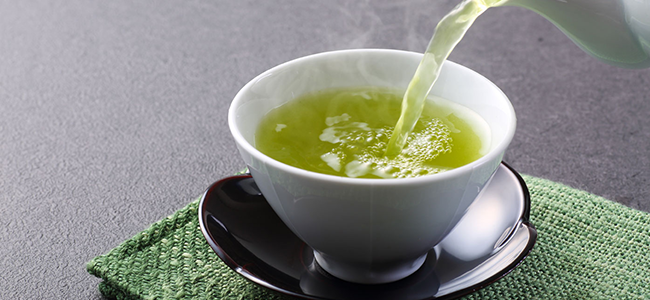
Where is `saucer`? Image resolution: width=650 pixels, height=300 pixels. saucer is located at coordinates (478, 256).